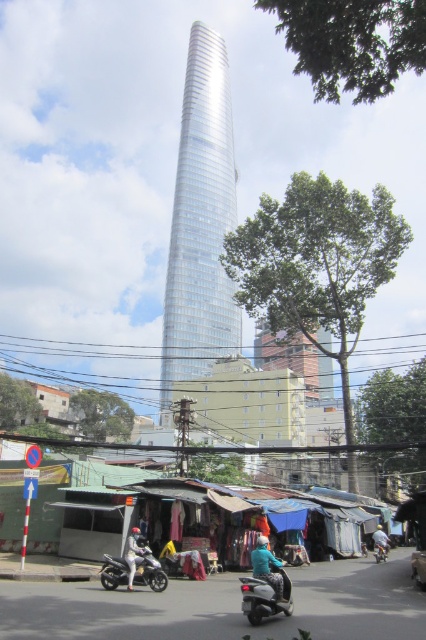
Is point (158, 563) farther from viewer compared to point (276, 561)?

Yes, it is behind point (276, 561).

Does silver metallic motorcycle at lower left have a larger size compared to teal matte jacket at center?

No, silver metallic motorcycle at lower left is not bigger than teal matte jacket at center.

Is point (166, 580) in front of point (270, 556)?

No, it is not.

At what (x,y) coordinates should I click in order to perform the action: click on silver metallic motorcycle at lower left. Please return your answer as a coordinate pair (x, y). The height and width of the screenshot is (640, 426). Looking at the image, I should click on (149, 570).

Can you confirm if metallic silver scooter at center is wider than metallic silver motorcycle at center?

Correct, the width of metallic silver scooter at center exceeds that of metallic silver motorcycle at center.

Who is lower down, metallic silver scooter at center or metallic silver motorcycle at center?

metallic silver motorcycle at center is lower down.

Find the location of a particular element. The image size is (426, 640). metallic silver scooter at center is located at coordinates (264, 596).

Find the location of `teal matte jacket at center`. teal matte jacket at center is located at coordinates (267, 566).

Does teal matte jacket at center lie in front of metallic silver motorcycle at center?

Yes, teal matte jacket at center is closer to the viewer.

Locate an element on the screen. teal matte jacket at center is located at coordinates (267, 566).